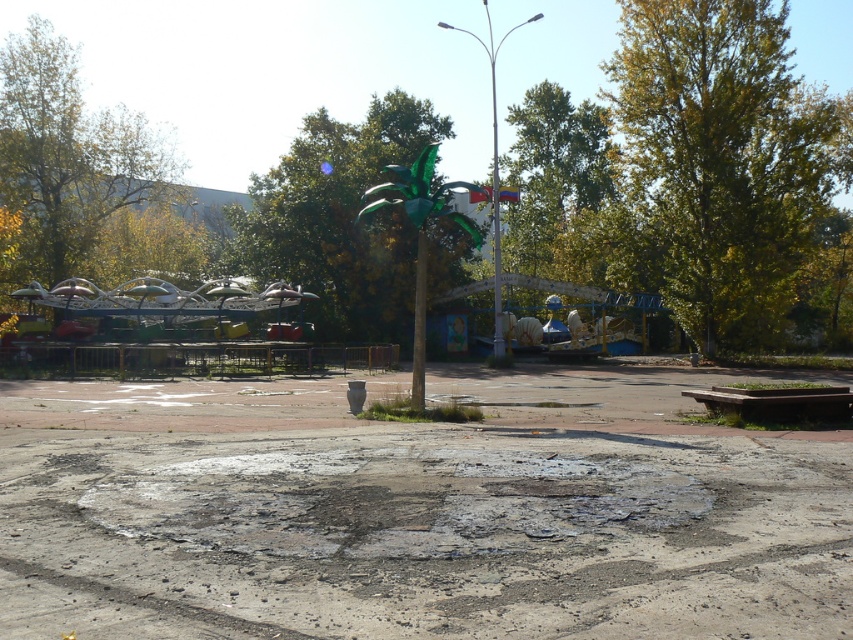
You are standing in the park and want to take a photo of the green leafy tree at upper right and the green leafy tree at left. Which tree is higher in the frame?

The green leafy tree at upper right is positioned over the green leafy tree at left, so it appears higher in the frame.

Based on the photo, you are a landscape architect designing a new park layout. You need to place a new bench between the green leafy tree at upper right and the green leafy tree at left. Based on their sizes, which tree would require more space for the bench placement?

The green leafy tree at left requires more space because it occupies more space than the green leafy tree at upper right.

You are a maintenance worker inspecting the park. You see the concrete pavement at center and the green metallic tree at center. Which object is nearer to you?

The concrete pavement at center is closer to the viewer than the green metallic tree at center, so the concrete pavement at center is nearer.